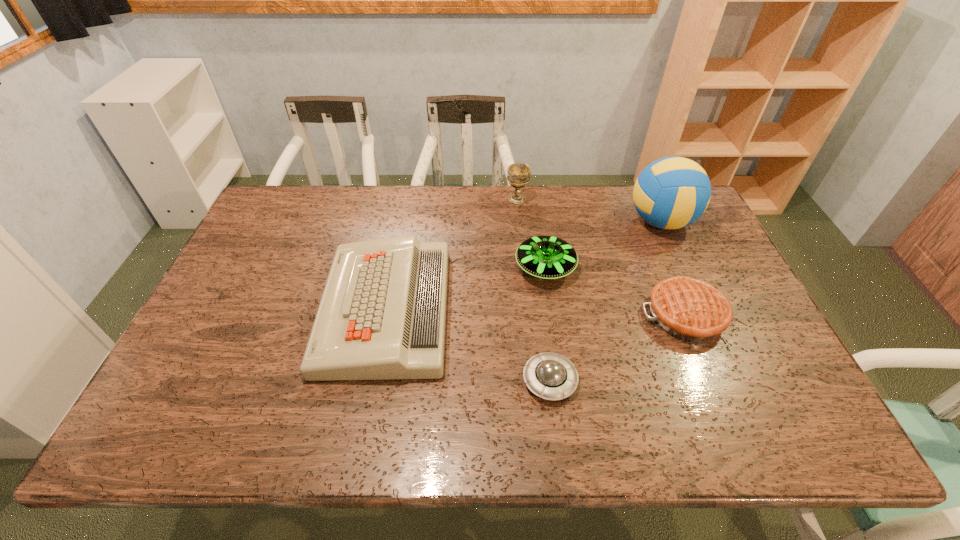
In the image, there is a desktop. Identify the location of vacant space at the left edge. click(x=282, y=239).

At what (x,y) coordinates should I click in order to perform the action: click on vacant area at the far left corner of the desktop. Please return your answer as a coordinate pair (x, y). This screenshot has height=540, width=960. Looking at the image, I should click on (306, 193).

Locate an element on the screen. unoccupied area between the chalice and the leftmost object is located at coordinates (451, 254).

Image resolution: width=960 pixels, height=540 pixels. What are the coordinates of `free point between the volleyball and the fifth shortest object` in the screenshot? It's located at (588, 211).

You are a GUI agent. You are given a task and a screenshot of the screen. Output one action in this format:
    pyautogui.click(x=<x>, y=<y>)
    Task: Click on the vacant area that lies between the computer keyboard and the shortest object
    
    Given the screenshot: What is the action you would take?
    pyautogui.click(x=468, y=345)

Image resolution: width=960 pixels, height=540 pixels. Find the location of `empty location between the taller saucer and the shorter saucer`. empty location between the taller saucer and the shorter saucer is located at coordinates (547, 324).

The width and height of the screenshot is (960, 540). Find the location of `vacant area that lies between the taller saucer and the nearer saucer`. vacant area that lies between the taller saucer and the nearer saucer is located at coordinates (x=547, y=324).

Identify the location of free space between the volleyball and the fifth shortest object. (588, 211).

Where is `free point between the tallest object and the pie`? The image size is (960, 540). free point between the tallest object and the pie is located at coordinates (673, 268).

Identify the location of vacant area that lies between the computer keyboard and the pie. The height and width of the screenshot is (540, 960). (536, 312).